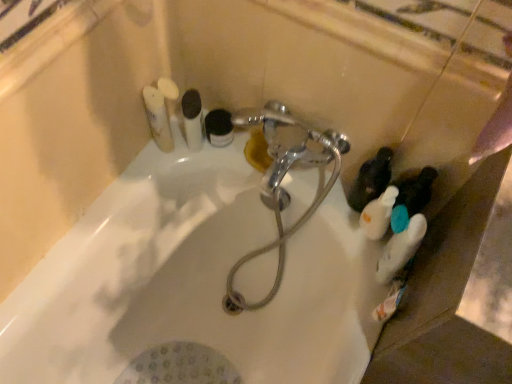
Find the location of a particular element. The image size is (512, 384). free location in front of white matte toothpaste tube at upper left, which appears as the 6th toiletry when viewed from the right is located at coordinates (136, 183).